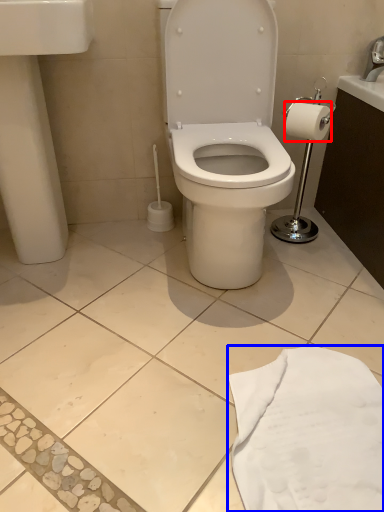
Question: Which object is further to the camera taking this photo, toilet paper (highlighted by a red box) or cloth (highlighted by a blue box)?

Choices:
 (A) toilet paper
 (B) cloth

Answer: (A)